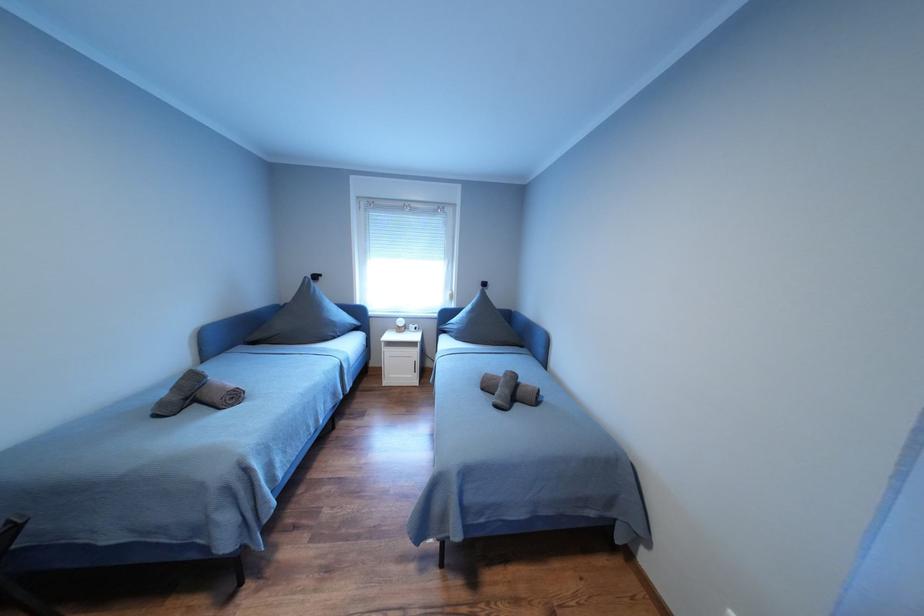
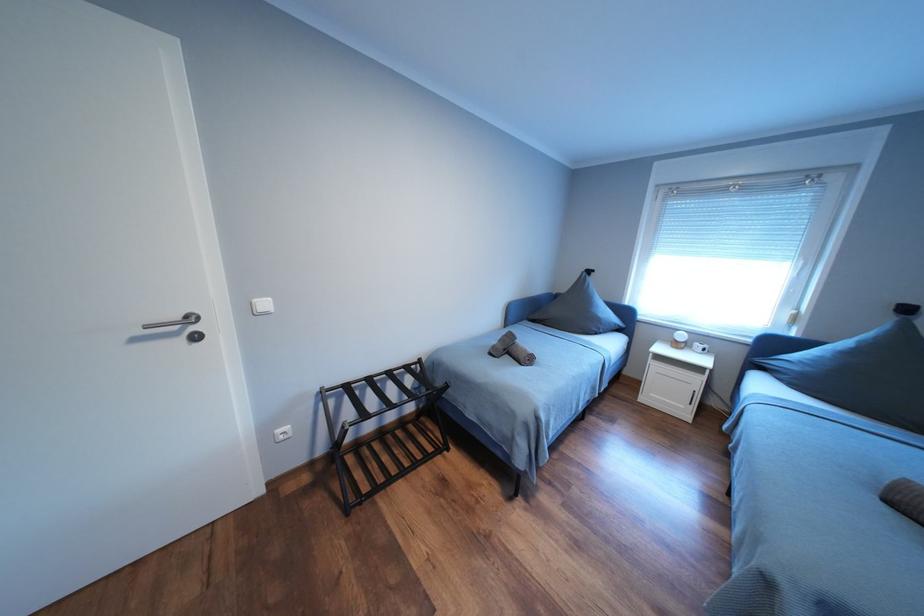
Question: The camera is either moving clockwise (left) or counter-clockwise (right) around the object. The first image is from the beginning of the video and the second image is from the end. Is the camera moving left or right when shooting the video?

Choices:
 (A) Left
 (B) Right

Answer: (B)